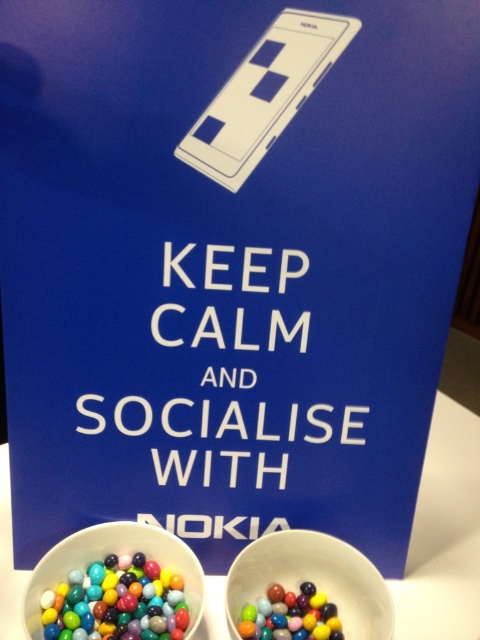
You are standing in front of the promotional setup and want to take a photo of the two points mentioned. Which point, point (173, 580) or point (277, 596), will appear larger in your camera view?

Point (173, 580) is closer to the camera than point (277, 596), so it will appear larger in the camera view.

You are organizing a party and need to choose between the glossy plastic candies at lower left and the glossy plastic candy at lower center for a candy bar. Based on their sizes, which option would allow more candies to fit in a standard bowl?

The glossy plastic candies at lower left are wider than the glossy plastic candy at lower center, so choosing the glossy plastic candy at lower center would allow more candies to fit in a standard bowl since they are smaller in width.

You are a photographer setting up a shoot for a candy brand. You have to ensure that the glossy plastic candies at lower left are in focus while capturing the Nokia smartphone illustration at the top. Given that your camera can only focus on objects within a 20 inch range, can you achieve this without moving the camera?

The glossy plastic candies at lower left are 23.92 inches away from the camera. Since the camera can only focus within a 20 inch range, the candies are outside the focus range and cannot be captured in focus without adjusting the camera position or focus settings.